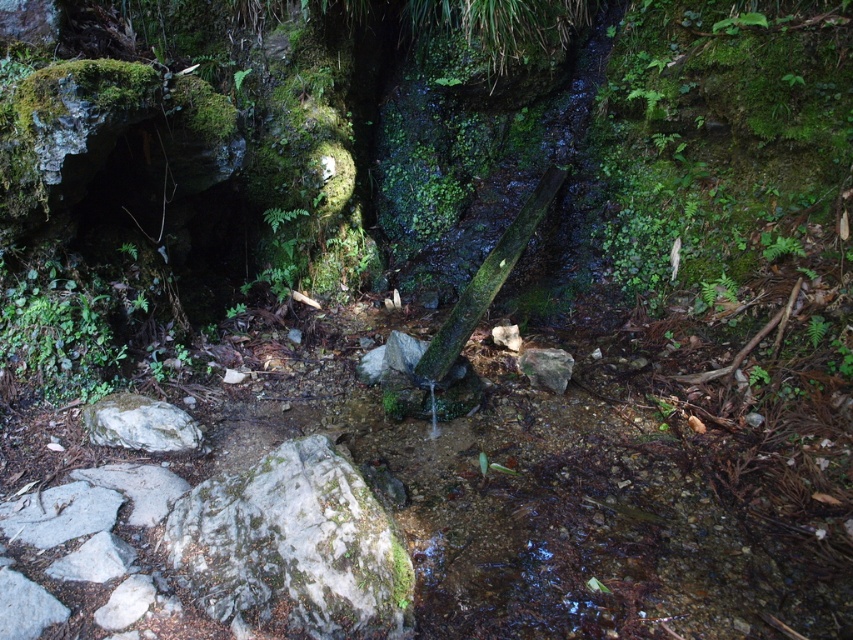
Between point (94, 426) and point (534, 387), which one is positioned in front?

Positioned in front is point (94, 426).

Is gray/rough rock at lower left below gray rough rock at center?

Yes, gray/rough rock at lower left is below gray rough rock at center.

The width and height of the screenshot is (853, 640). Describe the element at coordinates (141, 424) in the screenshot. I see `gray/rough rock at lower left` at that location.

Find the location of a particular element. This screenshot has height=640, width=853. gray/rough rock at lower left is located at coordinates (141, 424).

Is gray rough rock at lower left bigger than gray/rough rock at lower left?

Actually, gray rough rock at lower left might be smaller than gray/rough rock at lower left.

Can you confirm if gray rough rock at lower left is thinner than gray/rough rock at lower left?

Yes, gray rough rock at lower left is thinner than gray/rough rock at lower left.

Does point (24, 520) come behind point (184, 422)?

No, (24, 520) is closer to viewer.

Where is `gray rough rock at lower left`? The image size is (853, 640). gray rough rock at lower left is located at coordinates (59, 513).

Which is above, gray/mossy rock at center-left or gray rough rock at lower left?

gray rough rock at lower left

Is gray/mossy rock at center-left to the left of gray rough rock at lower left from the viewer's perspective?

No, gray/mossy rock at center-left is not to the left of gray rough rock at lower left.

Which is behind, point (334, 621) or point (100, 492)?

The point (100, 492) is more distant.

At what (x,y) coordinates should I click in order to perform the action: click on gray/mossy rock at center-left. Please return your answer as a coordinate pair (x, y). Image resolution: width=853 pixels, height=640 pixels. Looking at the image, I should click on (294, 545).